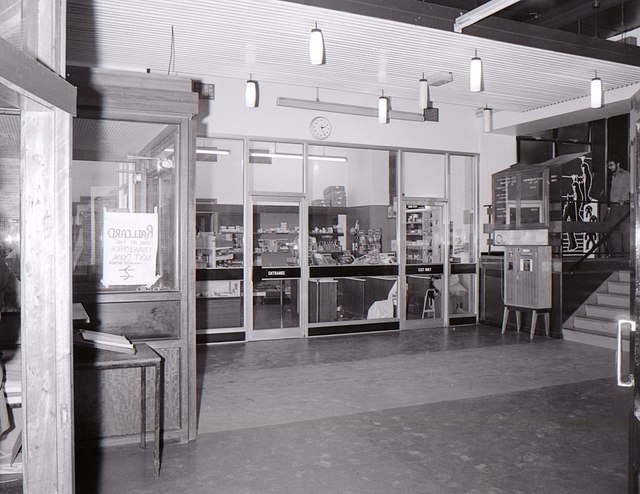
The width and height of the screenshot is (640, 494). I want to click on table, so click(x=138, y=360).